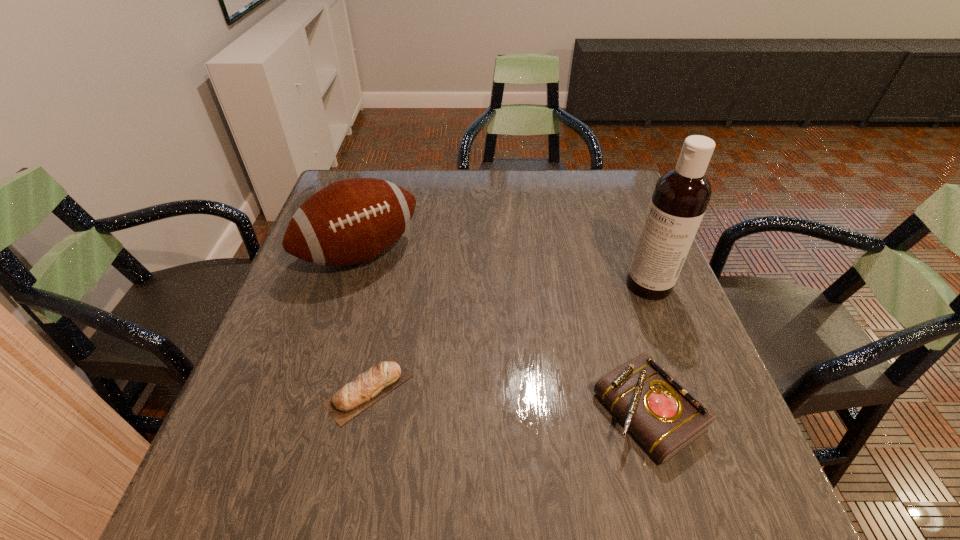
Image resolution: width=960 pixels, height=540 pixels. Identify the location of the shortest object. (367, 388).

At what (x,y) coordinates should I click in order to perform the action: click on diary. Please return your answer as a coordinate pair (x, y). The height and width of the screenshot is (540, 960). Looking at the image, I should click on (665, 417).

Identify the location of football. (351, 221).

I want to click on dishwasher detergent, so click(681, 195).

This screenshot has width=960, height=540. Identify the location of free location located on the back of the shortest object. (381, 333).

Where is `vacant region located 0.150m on the left of the diary`? This screenshot has width=960, height=540. vacant region located 0.150m on the left of the diary is located at coordinates (515, 412).

Locate an element on the screen. This screenshot has height=540, width=960. vacant region located 0.240m on the laces of the football is located at coordinates (440, 345).

Identify the location of free spot located 0.120m on the laces of the football. Image resolution: width=960 pixels, height=540 pixels. (412, 310).

You are a GUI agent. You are given a task and a screenshot of the screen. Output one action in this format:
    pyautogui.click(x=<x>, y=<y>)
    Task: Click on the free space located on the laces of the football
    This screenshot has width=960, height=540.
    Given the screenshot: What is the action you would take?
    pyautogui.click(x=452, y=361)

You are a GUI agent. You are given a task and a screenshot of the screen. Output one action in this format:
    pyautogui.click(x=<x>, y=<y>)
    Task: Click on the free space located on the label side of the tallest object
    The height and width of the screenshot is (540, 960).
    Given the screenshot: What is the action you would take?
    click(506, 383)